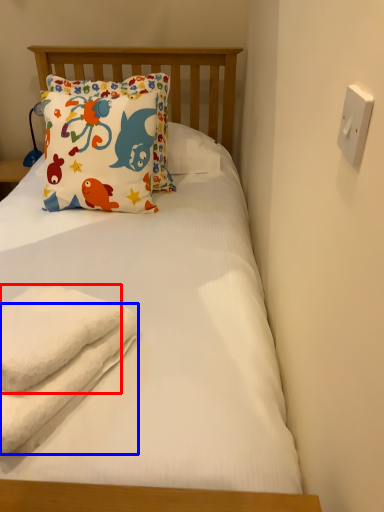
Question: Among these objects, which one is nearest to the camera, towel (highlighted by a red box) or beach towel (highlighted by a blue box)?

Choices:
 (A) towel
 (B) beach towel

Answer: (B)